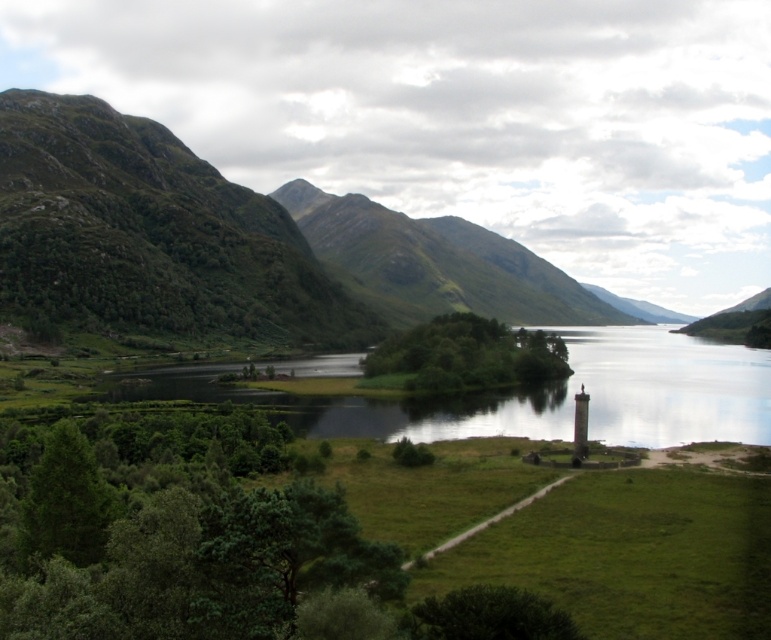
Question: From the image, what is the correct spatial relationship of green leafy tree at center in relation to green leafy tree at lower left?

Choices:
 (A) above
 (B) below

Answer: (A)

Question: Which object is closer to the camera taking this photo?

Choices:
 (A) green leafy tree at lower left
 (B) green leafy tree at center

Answer: (A)

Question: Based on their relative distances, which object is nearer to the green leafy tree at center?

Choices:
 (A) green grassy mountain at left
 (B) green leafy tree at lower left
 (C) green grassy water at center

Answer: (C)

Question: Which point is closer to the camera taking this photo?

Choices:
 (A) (527, 355)
 (B) (544, 291)
 (C) (311, 408)

Answer: (C)

Question: Can you confirm if green grassy mountain at left is wider than green leafy tree at lower left?

Choices:
 (A) yes
 (B) no

Answer: (A)

Question: Where is green grassy mountain at left located in relation to green grassy water at center in the image?

Choices:
 (A) below
 (B) above

Answer: (B)